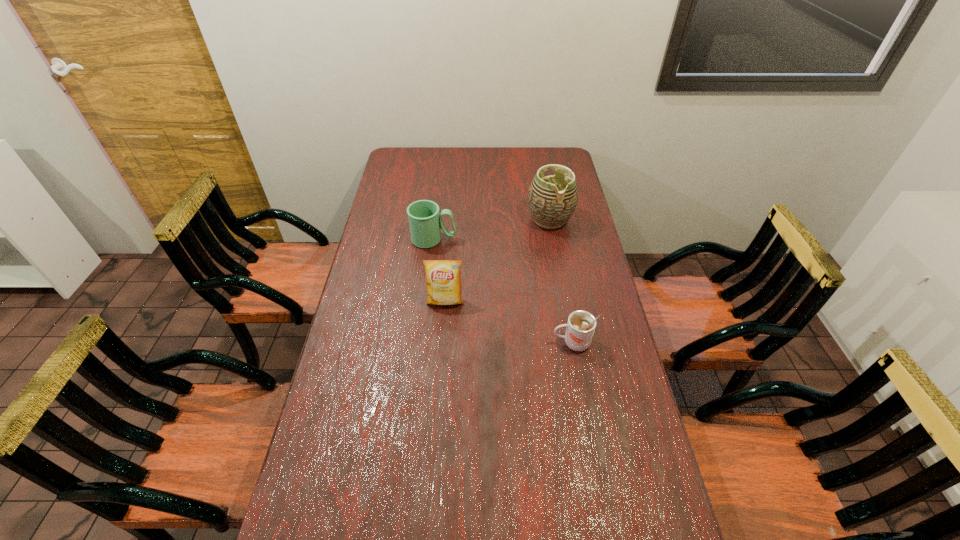
Where is `pottery located at the right edge`? The image size is (960, 540). pottery located at the right edge is located at coordinates (552, 200).

Locate an element on the screen. Image resolution: width=960 pixels, height=540 pixels. cup that is positioned at the right edge is located at coordinates (581, 325).

At what (x,y) coordinates should I click in order to perform the action: click on vacant space at the far edge of the desktop. Please return your answer as a coordinate pair (x, y). This screenshot has height=540, width=960. Looking at the image, I should click on pyautogui.click(x=499, y=147).

At what (x,y) coordinates should I click in order to perform the action: click on vacant point at the left edge. Please return your answer as a coordinate pair (x, y). Looking at the image, I should click on (381, 393).

Locate an element on the screen. The image size is (960, 540). vacant space at the right edge is located at coordinates click(x=621, y=347).

At what (x,y) coordinates should I click in order to perform the action: click on free spot between the mug and the pottery. Please return your answer as a coordinate pair (x, y). Looking at the image, I should click on (492, 230).

You are a GUI agent. You are given a task and a screenshot of the screen. Output one action in this format:
    pyautogui.click(x=<x>, y=<y>)
    Task: Click on the empty space between the tallest object and the mug
    
    Given the screenshot: What is the action you would take?
    pyautogui.click(x=492, y=230)

The height and width of the screenshot is (540, 960). I want to click on empty space that is in between the cup and the third farthest object, so click(509, 322).

The height and width of the screenshot is (540, 960). Identify the location of free space between the pottery and the nearest object. (561, 281).

Find the location of a particular element. the closest object to the crisp (potato chip) is located at coordinates (425, 221).